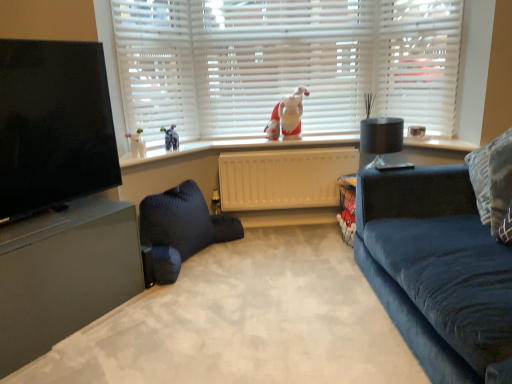
In order to face white plastic radiator at center, should I rotate leftwards or rightwards?

It's best to rotate right around 5.272 degrees.

Describe the element at coordinates (492, 179) in the screenshot. The image size is (512, 384). I see `patterned fabric pillow at right` at that location.

Locate an element on the screen. This screenshot has height=384, width=512. white plastic window sill at center is located at coordinates (234, 147).

Measure the distance between point (424, 140) and camera.

A distance of 2.71 meters exists between point (424, 140) and camera.

Image resolution: width=512 pixels, height=384 pixels. Describe the element at coordinates (280, 62) in the screenshot. I see `white matte blinds at center` at that location.

This screenshot has height=384, width=512. What do you see at coordinates (243, 322) in the screenshot? I see `velvet dark blue armchair at center` at bounding box center [243, 322].

What do you see at coordinates (53, 125) in the screenshot? I see `matte black tv at left` at bounding box center [53, 125].

Locate an element on the screen. The width and height of the screenshot is (512, 384). matte gray entertainment center at left is located at coordinates pos(58,198).

Is fuzzy fabric gnome at center next to patterned fabric pillow at right and touching it?

There is a gap between fuzzy fabric gnome at center and patterned fabric pillow at right.

Is fuzzy fabric gnome at center shorter than patterned fabric pillow at right?

Yes, fuzzy fabric gnome at center is shorter than patterned fabric pillow at right.

Is velvet dark blue armchair at center oriented towards white plastic window frame at upper right?

No, velvet dark blue armchair at center is not oriented towards white plastic window frame at upper right.

Is velvet dark blue armchair at center bigger or smaller than white plastic window frame at upper right?

Clearly, velvet dark blue armchair at center is larger in size than white plastic window frame at upper right.

This screenshot has height=384, width=512. Identify the location of window frame positioned vertically above the velvet dark blue armchair at center (from a real-world perspective). (419, 62).

In terms of width, does white plastic window frame at upper right look wider or thinner when compared to velvet dark blue armchair at center?

Clearly, white plastic window frame at upper right has less width compared to velvet dark blue armchair at center.

Does white plastic window frame at upper right have a lesser height compared to velvet dark blue armchair at center?

No.

Considering the positions of points (435, 5) and (372, 372), is point (435, 5) farther from camera compared to point (372, 372)?

Yes, it is.

How far apart are white plastic window frame at upper right and velvet dark blue armchair at center?

They are 5.09 feet apart.

Considering the points (227, 155) and (183, 255), which point is in front, point (227, 155) or point (183, 255)?

The point (183, 255) is more forward.

Is white plastic radiator at center thinner than dark blue knitted bean bag at center?

Indeed, white plastic radiator at center has a lesser width compared to dark blue knitted bean bag at center.

Can you confirm if white plastic radiator at center is smaller than dark blue knitted bean bag at center?

Yes, white plastic radiator at center is smaller than dark blue knitted bean bag at center.

In the scene shown: Is white plastic radiator at center taller or shorter than dark blue knitted bean bag at center?

In the image, white plastic radiator at center appears to be taller than dark blue knitted bean bag at center.

What's the angular difference between white plastic radiator at center and velvet dark blue armchair at center's facing directions?

The facing directions of white plastic radiator at center and velvet dark blue armchair at center are 178 degrees apart.

From the picture: Considering the sizes of objects white plastic radiator at center and velvet dark blue armchair at center in the image provided, who is smaller, white plastic radiator at center or velvet dark blue armchair at center?

white plastic radiator at center is smaller.

Which of these two, white plastic radiator at center or velvet dark blue armchair at center, stands taller?

Standing taller between the two is white plastic radiator at center.

From a real-world perspective, who is located higher, white plastic radiator at center or velvet dark blue armchair at center?

From a 3D spatial view, white plastic radiator at center is above.

Is patterned fabric pillow at right wider than velvet dark blue armchair at center?

No, patterned fabric pillow at right is not wider than velvet dark blue armchair at center.

Is patterned fabric pillow at right taller or shorter than velvet dark blue armchair at center?

Clearly, patterned fabric pillow at right is taller compared to velvet dark blue armchair at center.

From the image's perspective, between patterned fabric pillow at right and velvet dark blue armchair at center, who is located below?

velvet dark blue armchair at center appears lower in the image.

Is velvet dark blue armchair at center located within patterned fabric pillow at right?

Definitely not — velvet dark blue armchair at center is not inside patterned fabric pillow at right.

From a real-world perspective, is velvet blue couch at right positioned over white plastic window sill at center based on gravity?

No, from a real-world perspective, velvet blue couch at right is not above white plastic window sill at center.

How distant is velvet blue couch at right from white plastic window sill at center?

velvet blue couch at right and white plastic window sill at center are 4.07 feet apart from each other.

From the picture: Is velvet blue couch at right far from white plastic window sill at center?

Yes, velvet blue couch at right is far from white plastic window sill at center.

The image size is (512, 384). In the image, there is a white plastic window sill at center. Identify the location of studio couch below it (from a real-world perspective). (437, 271).

The width and height of the screenshot is (512, 384). Identify the location of toy that appears behind the patterned fabric pillow at right. (287, 116).

At what (x,y) coordinates should I click in order to perform the action: click on window frame lying on the right of velvet dark blue armchair at center. Please return your answer as a coordinate pair (x, y). The width and height of the screenshot is (512, 384). Looking at the image, I should click on (419, 62).

From the image, which object appears to be farther from white plastic window frame at upper right, dark blue knitted bean bag at center or velvet dark blue armchair at center?

dark blue knitted bean bag at center.

Considering their positions, is fuzzy fabric gnome at center positioned closer to matte gray entertainment center at left than black matte lamp at right?

The object closer to matte gray entertainment center at left is fuzzy fabric gnome at center.

Which object lies further to the anchor point velvet dark blue armchair at center, fuzzy fabric gnome at center or matte gray entertainment center at left?

fuzzy fabric gnome at center is further to velvet dark blue armchair at center.

When comparing their distances from dark blue knitted bean bag at center, does fuzzy fabric gnome at center or white plastic window sill at center seem closer?

white plastic window sill at center is closer to dark blue knitted bean bag at center.

Estimate the real-world distances between objects in this image. Which object is further from matte black tv at left, velvet blue couch at right or velvet dark blue armchair at center?

velvet blue couch at right is positioned further to the anchor matte black tv at left.

When comparing their distances from velvet dark blue armchair at center, does white matte blinds at center or white plastic window sill at center seem closer?

white plastic window sill at center is positioned closer to the anchor velvet dark blue armchair at center.

Which object lies nearer to the anchor point velvet blue couch at right, white matte blinds at center or dark blue knitted bean bag at center?

The object closer to velvet blue couch at right is dark blue knitted bean bag at center.

When comparing their distances from black matte lamp at right, does white plastic window sill at center or white plastic window frame at upper right seem closer?

white plastic window frame at upper right lies closer to black matte lamp at right than the other object.

At what (x,y) coordinates should I click in order to perform the action: click on window frame between velvet dark blue armchair at center and fuzzy fabric gnome at center in the front-back direction. Please return your answer as a coordinate pair (x, y). The width and height of the screenshot is (512, 384). Looking at the image, I should click on (419, 62).

Locate an element on the screen. Image resolution: width=512 pixels, height=384 pixels. window sill between matte gray entertainment center at left and patterned fabric pillow at right from left to right is located at coordinates (234, 147).

The width and height of the screenshot is (512, 384). I want to click on toy between velvet blue couch at right and white plastic radiator at center along the z-axis, so click(x=287, y=116).

Where is `window sill between velvet dark blue armchair at center and patterned fabric pillow at right in the horizontal direction`? window sill between velvet dark blue armchair at center and patterned fabric pillow at right in the horizontal direction is located at coordinates (234, 147).